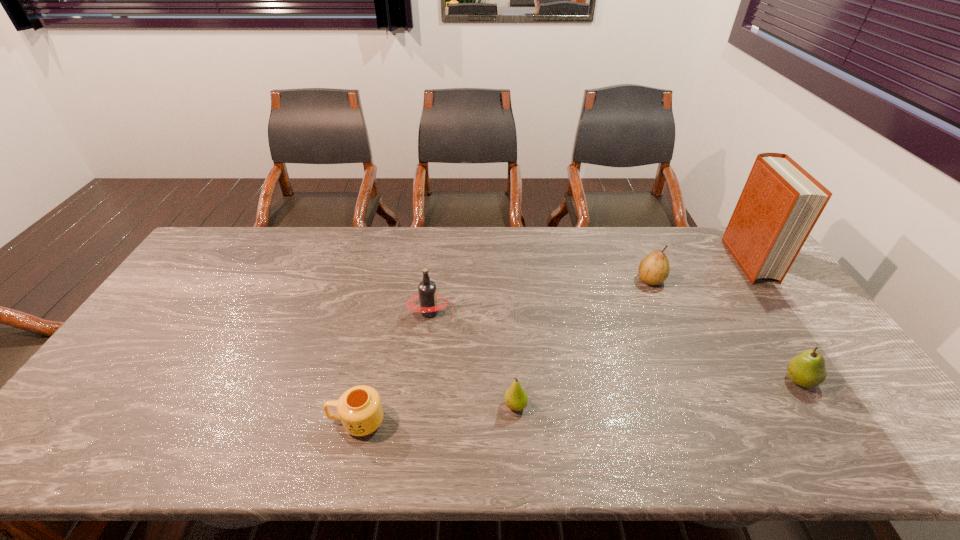
Locate an element on the screen. The image size is (960, 540). free space between the tallest object and the second nearest pear is located at coordinates (774, 320).

Identify the location of free space between the leftmost object and the rightmost pear. (578, 401).

The height and width of the screenshot is (540, 960). Identify the location of free space between the farthest pear and the second object from right to left. (725, 330).

What are the coordinates of `free space between the third nearest object and the farthest pear` in the screenshot? It's located at (725, 330).

The image size is (960, 540). What are the coordinates of `vacant area between the fourth object from right to left and the fifth object from left to right` in the screenshot? It's located at (658, 393).

Image resolution: width=960 pixels, height=540 pixels. In order to click on vacant space that's between the rightmost object and the mug in this screenshot , I will do `click(553, 341)`.

Identify the location of vacant area between the mug and the fifth object from right to left. This screenshot has width=960, height=540. (394, 367).

Locate an element on the screen. This screenshot has width=960, height=540. free space between the leftmost object and the root beer is located at coordinates (394, 367).

The image size is (960, 540). Find the location of `free space between the third object from right to left and the third nearest object`. free space between the third object from right to left and the third nearest object is located at coordinates (725, 330).

At what (x,y) coordinates should I click in order to perform the action: click on free point between the rightmost pear and the third farthest object. Please return your answer as a coordinate pair (x, y). Looking at the image, I should click on (614, 346).